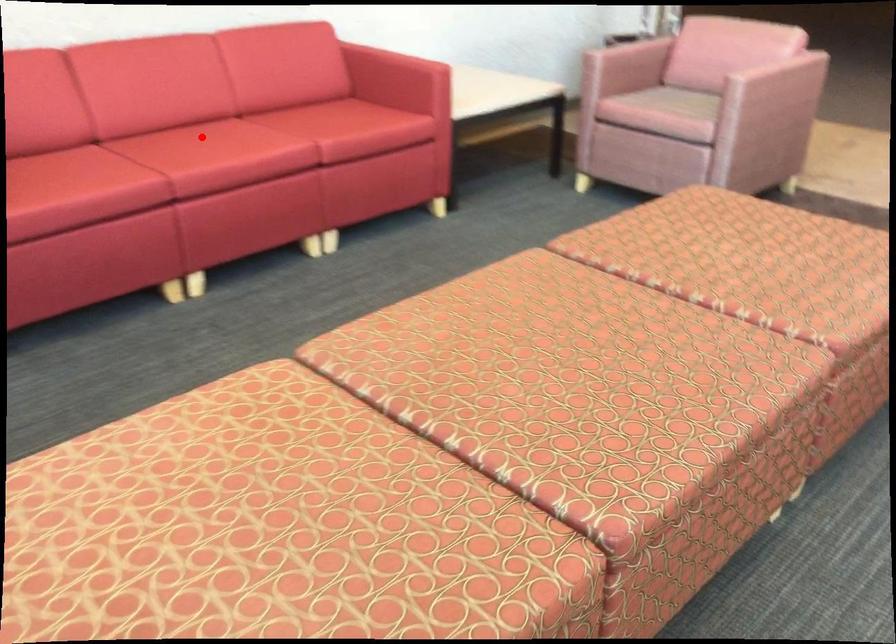
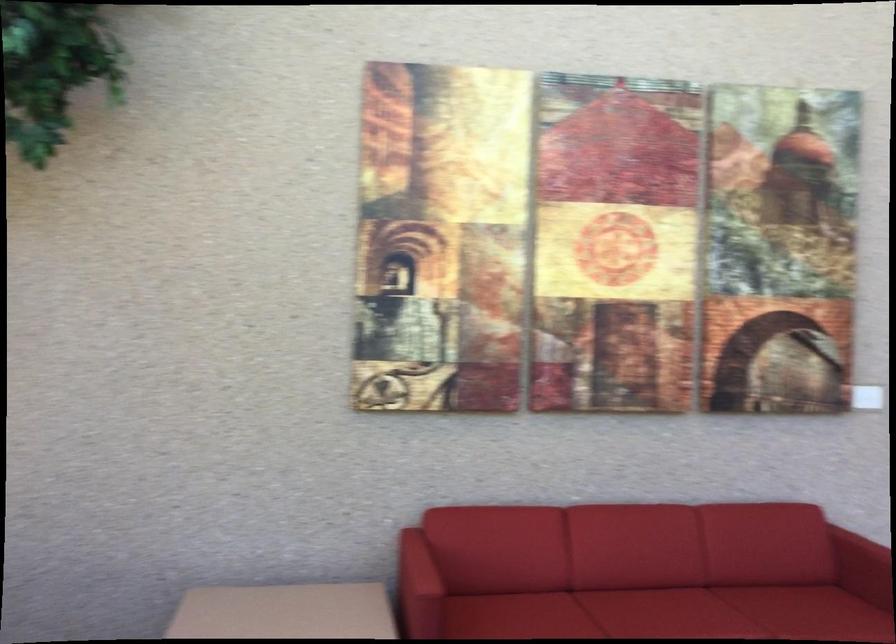
Where in the second image is the point corresponding to the highlighted location from the first image?

(659, 607)